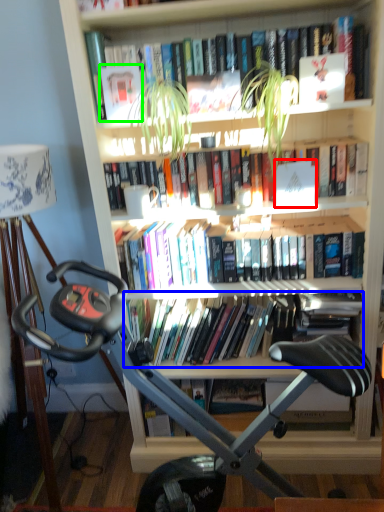
Question: Considering the real-world distances, which object is farthest from paperback book (highlighted by a red box)? book (highlighted by a blue box) or paperback book (highlighted by a green box)?

Choices:
 (A) book
 (B) paperback book

Answer: (B)